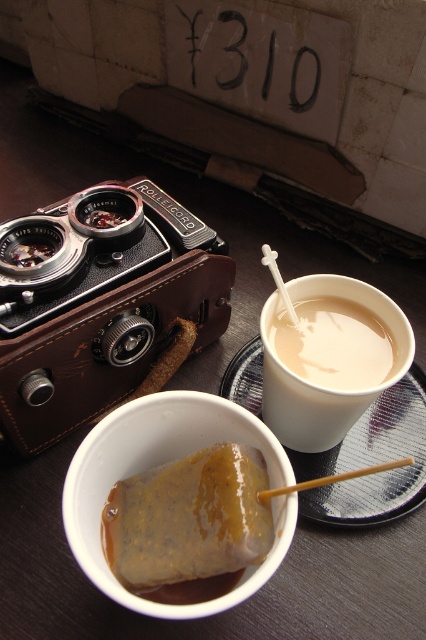
You are setting up a photography display and need to arrange items on a shelf. You have a vintage Rolleicord camera and two cups. The white matte cup at upper right and the matte plastic cup at upper right are both on the shelf. According to the image, which cup is positioned to the left of the other?

The white matte cup at upper right is positioned to the left of the matte plastic cup at upper right.

You are setting up a photography exhibition and need to place a Rolleicord camera on a table. The table has limited space between two other objects. You have the white matte cup at upper right and the matte plastic cup at upper right. Which cup takes up more horizontal space on the table?

The white matte cup at upper right has a greater width than the matte plastic cup at upper right, so it occupies more horizontal space on the table.

You are a photographer setting up your vintage Rolleicord camera on a dark wooden table. You have two disposable cups nearby. One is a white matte cup at upper right and the other is a matte plastic cup at upper right. Which cup has a greater height?

The white matte cup at upper right is much taller than the matte plastic cup at upper right.